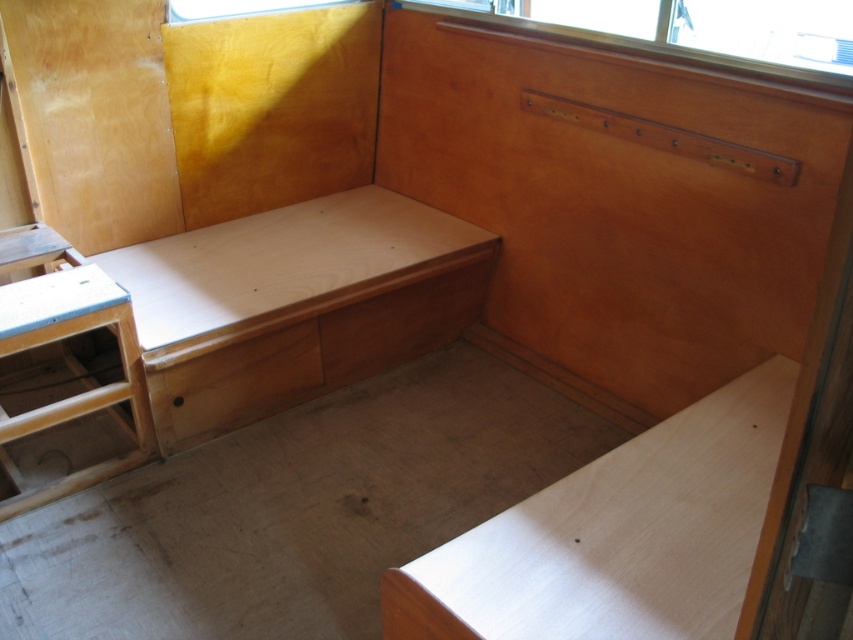
You are sitting on the bench in the corner of the room and want to reach both the light brown wood table at lower right and the natural wood drawer at center. Which object is easier to reach without moving from the bench?

The light brown wood table at lower right is closer to the viewer than the natural wood drawer at center, so it is easier to reach without moving from the bench.